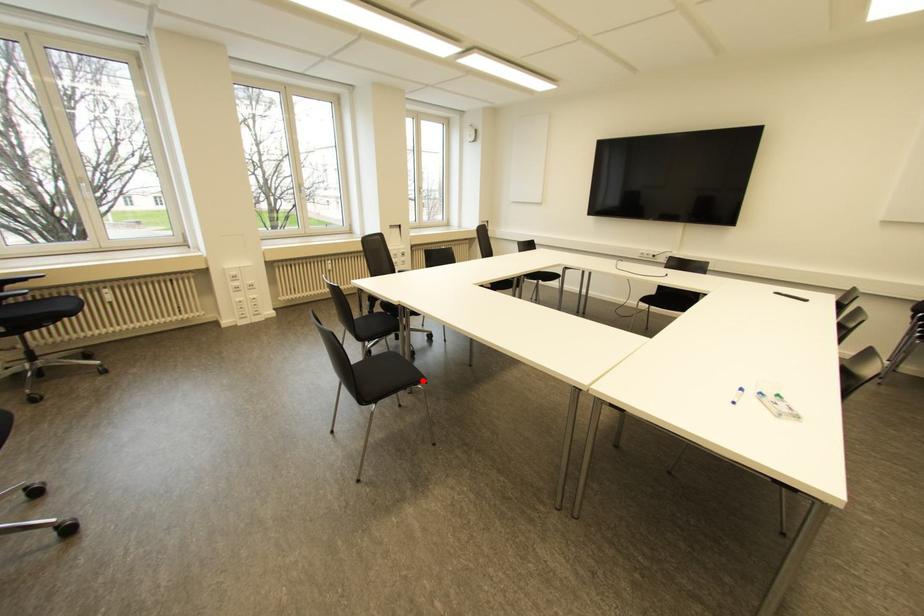
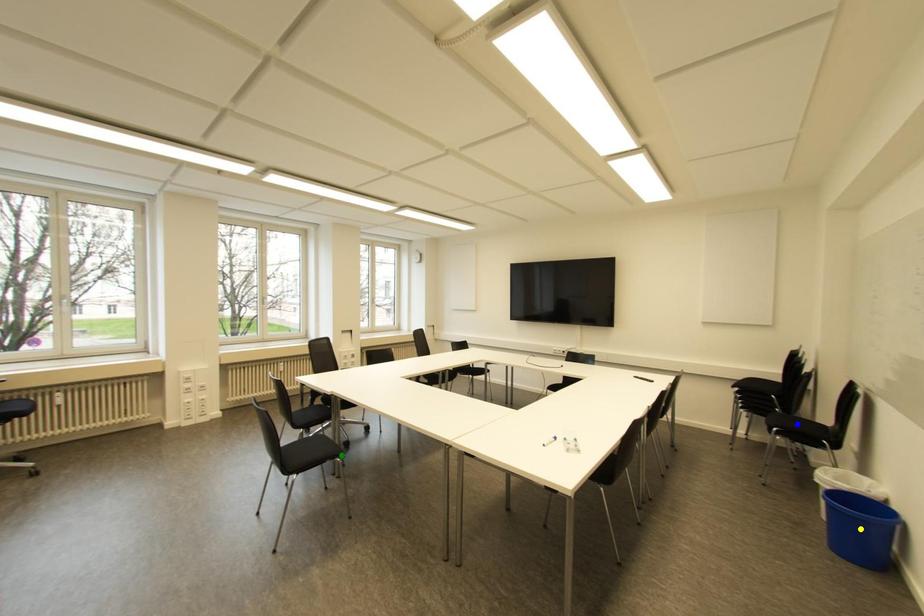
Question: I am providing you with two images of the same scene from different viewpoints. A red point is marked on the first image. You are given multiple points on the second image. Which point in image 2 represents the same 3d spot as the red point in image 1?

Choices:
 (A) yellow point
 (B) blue point
 (C) green point

Answer: (C)